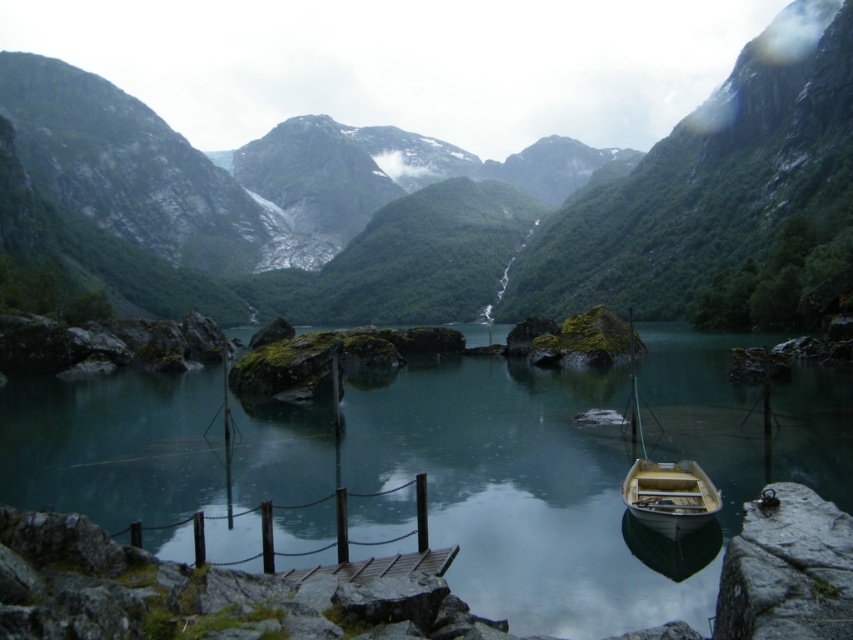
You are standing on the wooden dock and want to reach the point marked at coordinates (453, 467). Based on the scene description, where is this point located?

The point at coordinates (453, 467) is on the teal smooth water at center, so you need to row or swim to reach it since it is in the water.

You are standing at the edge of the water and want to walk to the point marked by point (830, 19) and point (703, 508). Which point is closer to you?

Point (830, 19) is further to the viewer than point (703, 508), so the closer point is point (703, 508).

You are a photographer positioned at the dock and want to capture the wooden boat at lower center and the teal smooth water at center in your shot. Based on their positions, which object will appear closer to the front of your photo?

The teal smooth water at center appears closer to the front of the photo because it is positioned in front of the wooden boat at lower center.